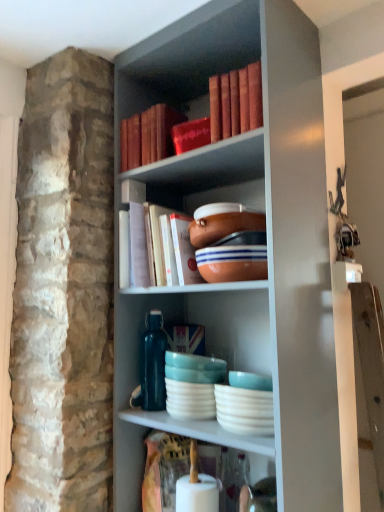
Question: Is matte white ceramic plates at center taller or shorter than matte red book at upper center, the first book when ordered from top to bottom?

Choices:
 (A) short
 (B) tall

Answer: (A)

Question: From the image's perspective, relative to matte red book at upper center, the 2th book from the bottom, is matte white ceramic plates at center above or below?

Choices:
 (A) above
 (B) below

Answer: (B)

Question: Which is nearer to the matte red book at upper center, the first book when ordered from top to bottom?

Choices:
 (A) matte orange bowl at center, positioned as the 2th bowl in top-to-bottom order
 (B) hardcover book at center, acting as the first book starting from the bottom
 (C) matte orange bowl at center, the 1th bowl positioned from the top
 (D) matte white ceramic plates at center

Answer: (B)

Question: Considering the real-world distances, which object is closest to the matte orange bowl at center, the 1th bowl positioned from the top?

Choices:
 (A) matte white ceramic plates at center
 (B) hardcover book at center, acting as the first book starting from the bottom
 (C) matte red book at upper center, the 2th book from the bottom
 (D) matte orange bowl at center, positioned as the 1th bowl in bottom-to-top order

Answer: (D)